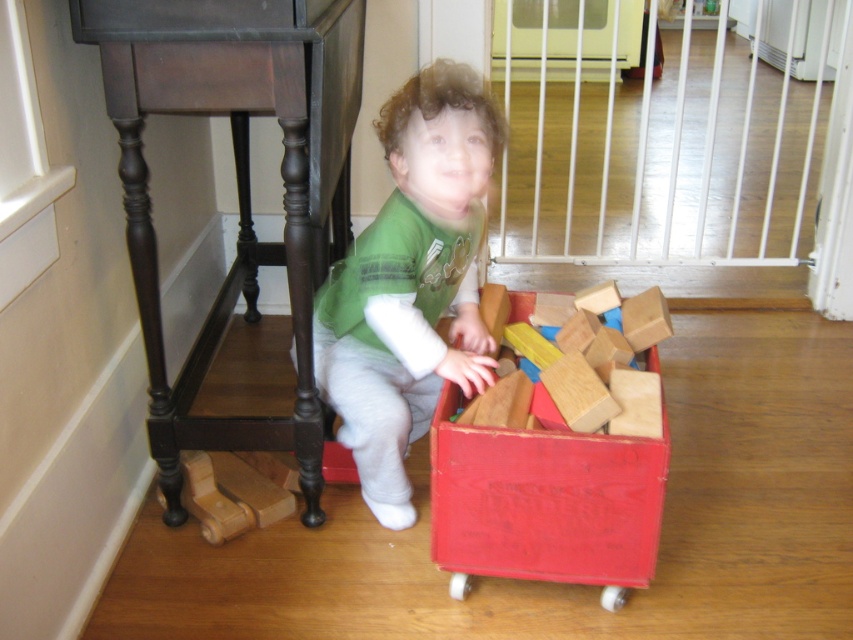
Who is more distant from viewer, (364, 298) or (440, 440)?

The point (364, 298) is more distant.

Who is more forward, (445, 250) or (633, 580)?

→ Point (633, 580)

The image size is (853, 640). I want to click on green matte shirt at center, so click(410, 282).